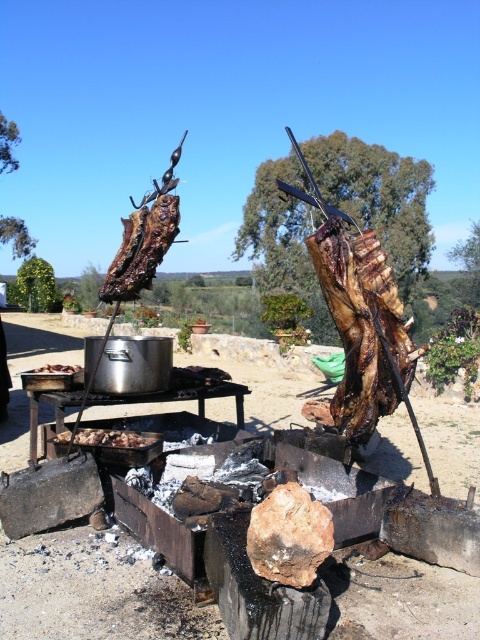
You are a chef preparing a meal. You need to place the brown charred meat at lower left on top of the charred wood plank at center. Can you do this without the meat falling off?

The charred wood plank at center is taller than brown charred meat at lower left, so yes, the brown charred meat at lower left can be placed on top of the charred wood plank at center without falling off since the plank is taller and provides a stable base.

You are a food safety inspector checking the cooking scene. You need to ensure that the brown charred meat at lower left and the brown charred meat at left are cooked properly. Which one is taller and requires more time to cook?

The brown charred meat at lower left is taller than the brown charred meat at left, so it requires more time to cook.